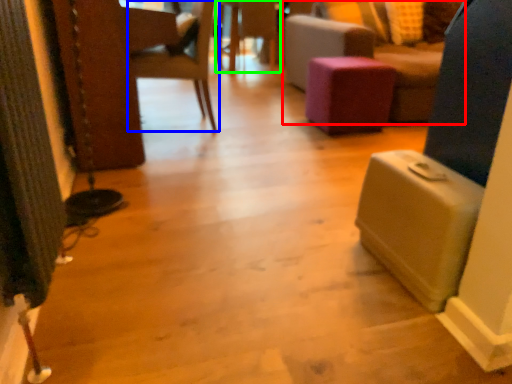
Question: Which is farther away from furniture (highlighted by a red box)? chair (highlighted by a blue box) or side table (highlighted by a green box)?

Choices:
 (A) chair
 (B) side table

Answer: (A)